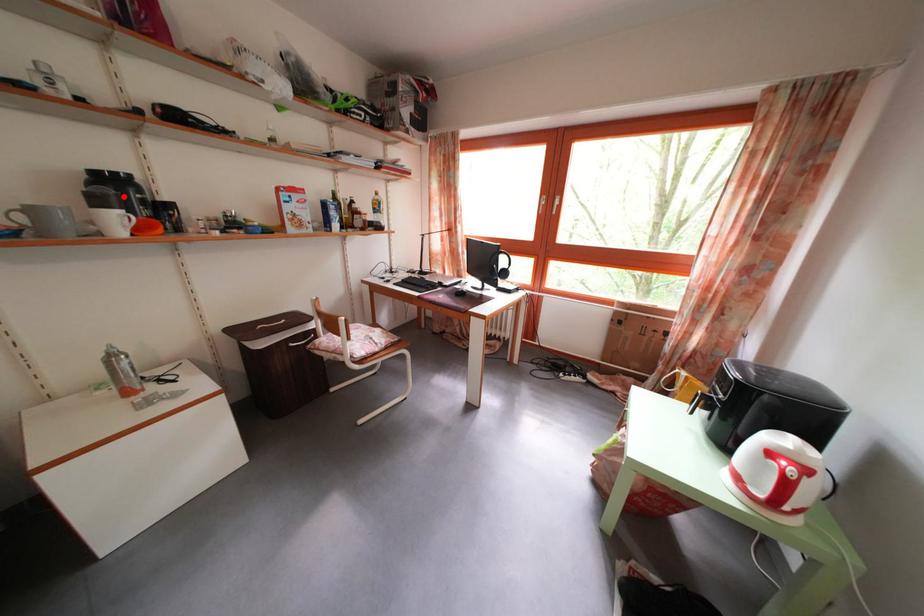
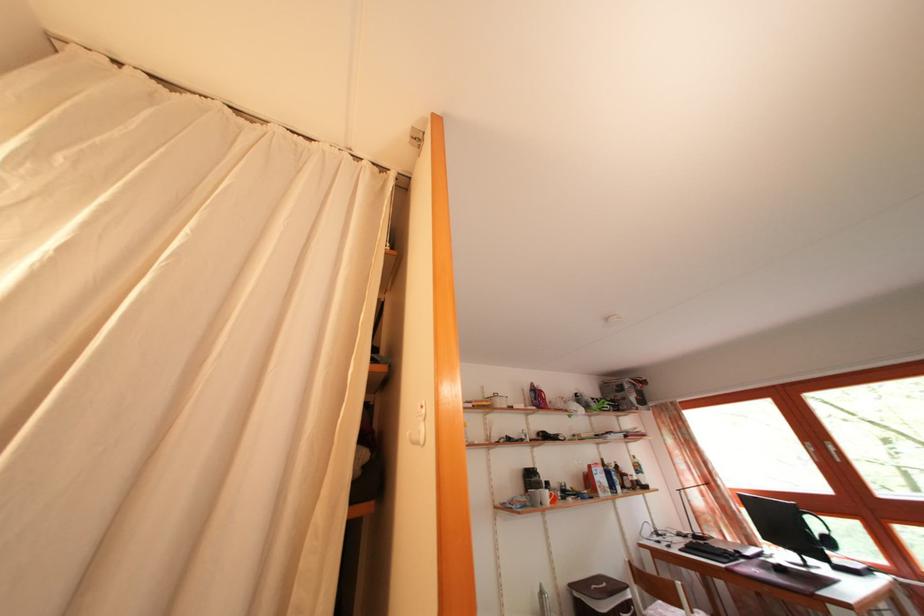
The point at the highlighted location is marked in the first image. Where is the corresponding point in the second image?

(538, 484)